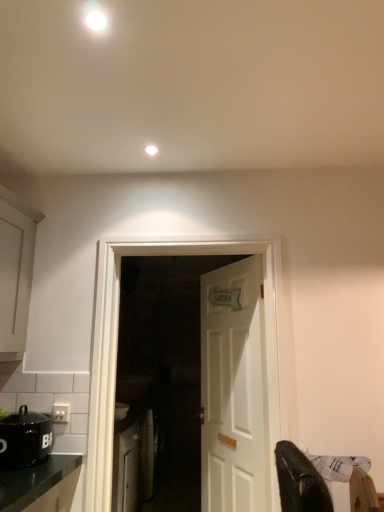
Question: Visually, is white matte cabinet at left, the 1th cabinetry viewed from the front, positioned to the left or to the right of black matte pot at lower left?

Choices:
 (A) left
 (B) right

Answer: (A)

Question: Is white matte cabinet at left, which is the second cabinetry from right to left, wider or thinner than black matte pot at lower left?

Choices:
 (A) wide
 (B) thin

Answer: (A)

Question: Which object is positioned closest to the white wooden door at center, the 1th door viewed from the front?

Choices:
 (A) white matte light fixture at upper center, which is the first lighting from back to front
 (B) black matte pot at lower left
 (C) white glossy cabinet at lower left, the 2th cabinetry positioned from the top
 (D) white glossy light fixture at upper center, arranged as the first lighting when viewed from the front
 (E) white matte cabinet at left, the 1th cabinetry viewed from the front

Answer: (B)

Question: Based on their relative distances, which object is farther from the white plastic electric outlet at lower left?

Choices:
 (A) white wooden door at center, arranged as the 1th door when viewed from the back
 (B) white glossy light fixture at upper center, marked as the 1th lighting in a left-to-right arrangement
 (C) white wooden door at center, the 1th door viewed from the front
 (D) white glossy cabinet at lower left, the 1th cabinetry when ordered from right to left
 (E) black matte pot at lower left

Answer: (B)